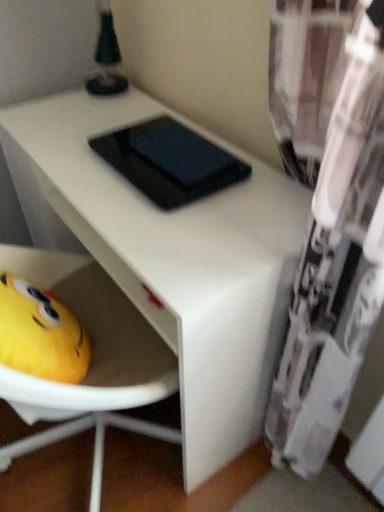
You are a GUI agent. You are given a task and a screenshot of the screen. Output one action in this format:
    pyautogui.click(x=<x>, y=<y>)
    Task: Click on the free point above black matte pad at center (from a real-world perspective)
    The image size is (384, 512).
    Given the screenshot: What is the action you would take?
    pyautogui.click(x=172, y=151)